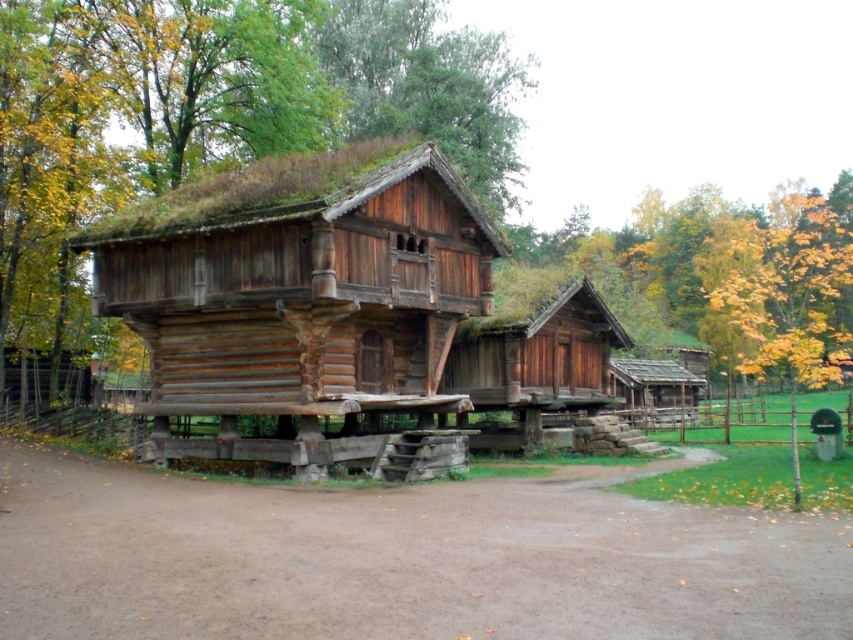
Question: Where is green mossy roof at center located in relation to yellow-green leaves at upper right in the image?

Choices:
 (A) above
 (B) below

Answer: (A)

Question: Is green mossy roof at center to the left of yellow-green leaves at upper right from the viewer's perspective?

Choices:
 (A) yes
 (B) no

Answer: (A)

Question: Where is green mossy roof at center located in relation to yellow-green leaves at upper right in the image?

Choices:
 (A) below
 (B) above

Answer: (B)

Question: Which point appears closest to the camera in this image?

Choices:
 (A) (735, 269)
 (B) (368, 124)

Answer: (B)